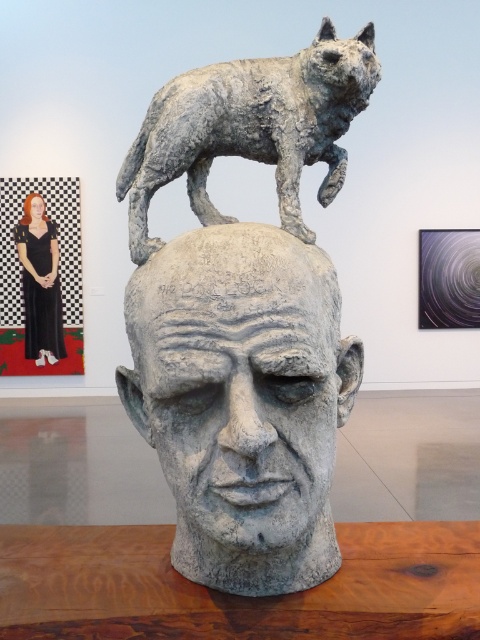
I want to click on black dress at upper left, so click(x=39, y=282).

Image resolution: width=480 pixels, height=640 pixels. I want to click on black dress at upper left, so click(39, 282).

From the picture: How far apart are gray stone head at center and black dress at upper left?

gray stone head at center and black dress at upper left are 5.74 meters apart.

Does point (237, 305) come in front of point (20, 244)?

Yes, point (237, 305) is in front of point (20, 244).

I want to click on gray stone head at center, so click(x=244, y=317).

Which is below, gray stone head at center or gray textured dog at upper center?

gray stone head at center is lower down.

Describe the element at coordinates (244, 317) in the screenshot. Image resolution: width=480 pixels, height=640 pixels. I see `gray stone head at center` at that location.

At what (x,y) coordinates should I click in order to perform the action: click on gray stone head at center. Please return your answer as a coordinate pair (x, y). Image resolution: width=480 pixels, height=640 pixels. Looking at the image, I should click on 244,317.